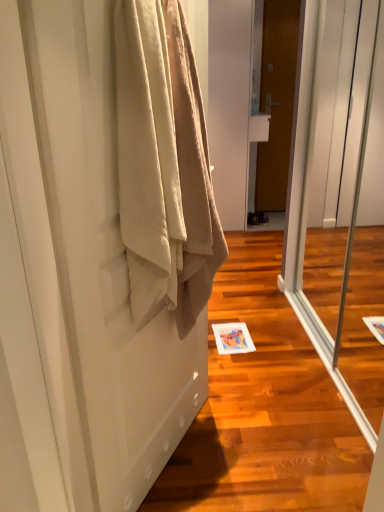
Question: From the image's perspective, is transparent glass screen door at center above beige textured towel at left?

Choices:
 (A) no
 (B) yes

Answer: (B)

Question: Is transparent glass screen door at center to the left of beige textured towel at left from the viewer's perspective?

Choices:
 (A) yes
 (B) no

Answer: (B)

Question: Is transparent glass screen door at center further to the viewer compared to beige textured towel at left?

Choices:
 (A) yes
 (B) no

Answer: (A)

Question: Is transparent glass screen door at center smaller than beige textured towel at left?

Choices:
 (A) no
 (B) yes

Answer: (A)

Question: Is the depth of transparent glass screen door at center less than that of beige textured towel at left?

Choices:
 (A) yes
 (B) no

Answer: (B)

Question: Is transparent glass screen door at center bigger or smaller than brown wooden door at center, which is counted as the 1th door, starting from the top?

Choices:
 (A) small
 (B) big

Answer: (B)

Question: From the image's perspective, is transparent glass screen door at center positioned above or below brown wooden door at center, the second door ordered from the bottom?

Choices:
 (A) below
 (B) above

Answer: (A)

Question: Is transparent glass screen door at center spatially inside brown wooden door at center, the 1th door viewed from the back, or outside of it?

Choices:
 (A) outside
 (B) inside

Answer: (A)

Question: Does point (334, 293) appear closer or farther from the camera than point (271, 108)?

Choices:
 (A) closer
 (B) farther

Answer: (A)

Question: Is point pyautogui.click(x=377, y=248) closer or farther from the camera than point pyautogui.click(x=215, y=239)?

Choices:
 (A) closer
 (B) farther

Answer: (B)

Question: From the image's perspective, is transparent glass screen door at center above or below beige textured towel at left?

Choices:
 (A) below
 (B) above

Answer: (B)

Question: Is transparent glass screen door at center wider or thinner than beige textured towel at left?

Choices:
 (A) thin
 (B) wide

Answer: (A)

Question: From their relative heights in the image, would you say transparent glass screen door at center is taller or shorter than beige textured towel at left?

Choices:
 (A) short
 (B) tall

Answer: (B)

Question: Considering the positions of point (291, 8) and point (29, 384), is point (291, 8) closer or farther from the camera than point (29, 384)?

Choices:
 (A) farther
 (B) closer

Answer: (A)

Question: Is brown wooden door at center, positioned as the first door in right-to-left order, situated inside beige fabric door at left, which is the first door in left-to-right order, or outside?

Choices:
 (A) outside
 (B) inside

Answer: (A)